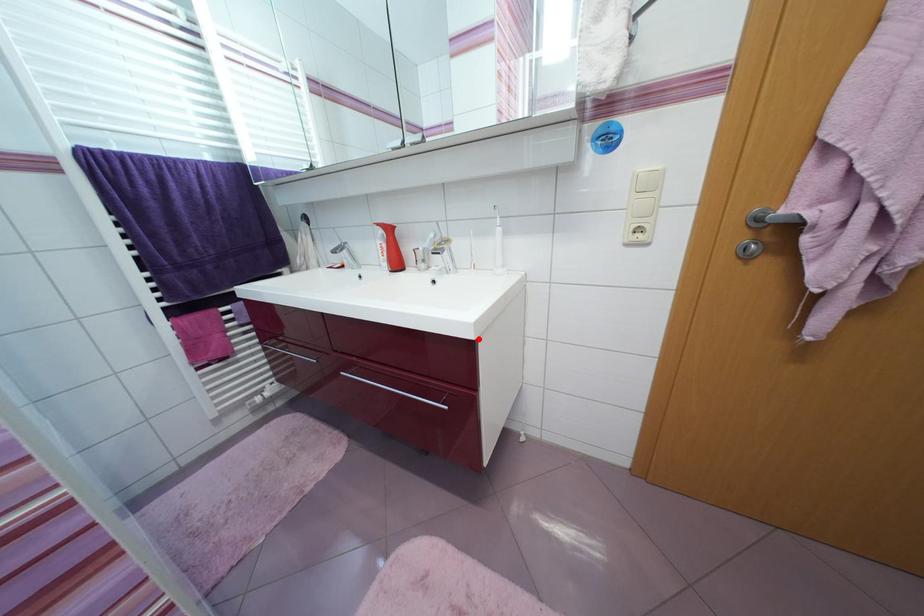
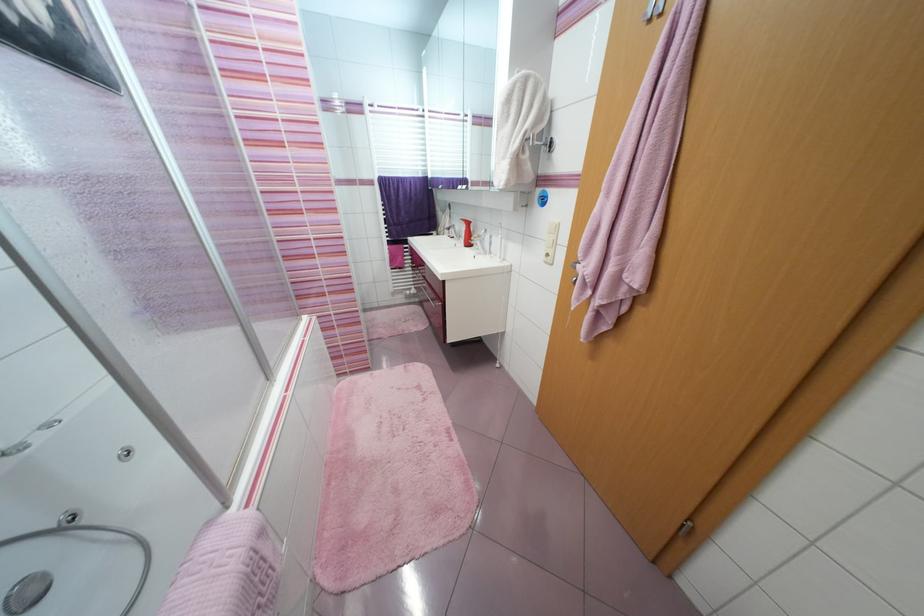
The point at the highlighted location is marked in the first image. Where is the corresponding point in the second image?

(445, 281)